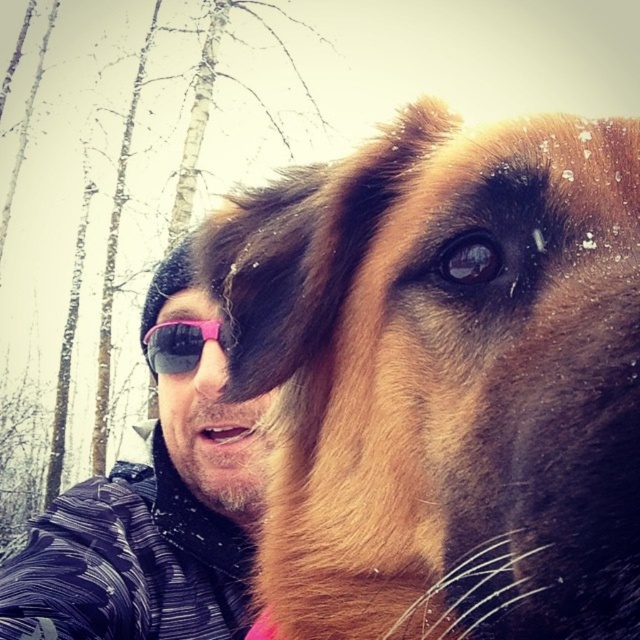
You are taking a photo with a brown furry dog at center and pink reflective sunglasses at center. If you want to ensure both objects are fully visible in the frame, which one should you adjust the camera focus to prioritize based on their sizes?

The brown furry dog at center is smaller in width than the pink reflective sunglasses at center, so you should prioritize focusing on the brown furry dog at center to ensure it is fully visible in the frame.

You are taking a selfie with your dog in the snow. You notice the pink reflective sunglasses at center and the brown fur nose at center. Which object is closer to the left side of the photo?

The pink reflective sunglasses at center is closer to the left side of the photo than the brown fur nose at center.

You are taking a selfie with your dog in the snow. You notice the pink reflective sunglasses at center and the brown fur nose at center in the frame. Which object appears wider in the photo?

The pink reflective sunglasses at center appears wider in the photo because its width is larger than that of the brown fur nose at center.